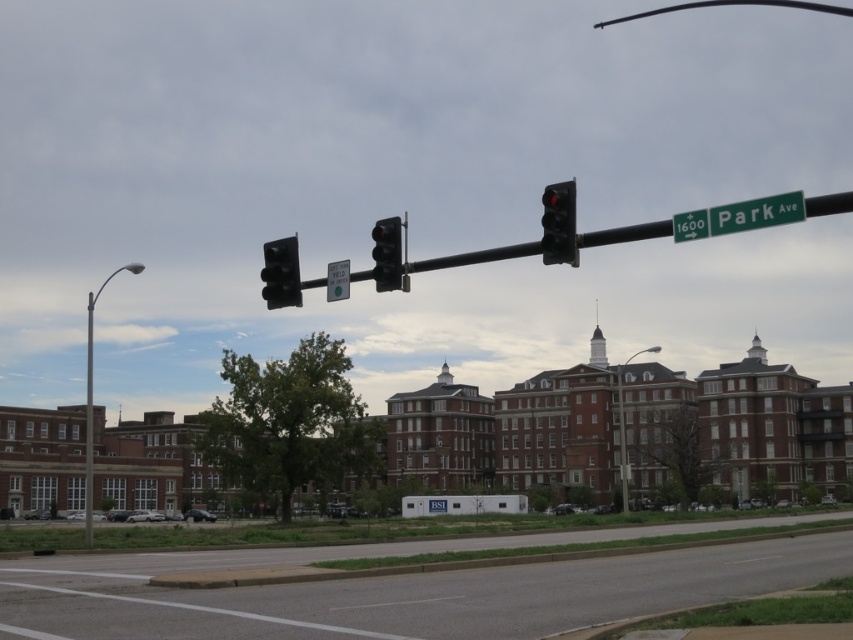
Question: Is green metallic street sign at upper right to the right of metallic silver streetlight at center from the viewer's perspective?

Choices:
 (A) yes
 (B) no

Answer: (B)

Question: Which object is closer to the camera taking this photo?

Choices:
 (A) metallic silver streetlight at center
 (B) green metallic street sign at upper right

Answer: (B)

Question: Which point is closer to the camera taking this photo?

Choices:
 (A) (387, 252)
 (B) (560, 230)

Answer: (B)

Question: Is green metallic street sign at upper right thinner than metallic silver streetlight at center?

Choices:
 (A) no
 (B) yes

Answer: (B)

Question: Is green metallic street sign at upper right below black glass traffic light at upper center?

Choices:
 (A) yes
 (B) no

Answer: (A)

Question: Which of the following is the closest to the observer?

Choices:
 (A) (726, 212)
 (B) (91, 440)
 (C) (386, 268)

Answer: (A)